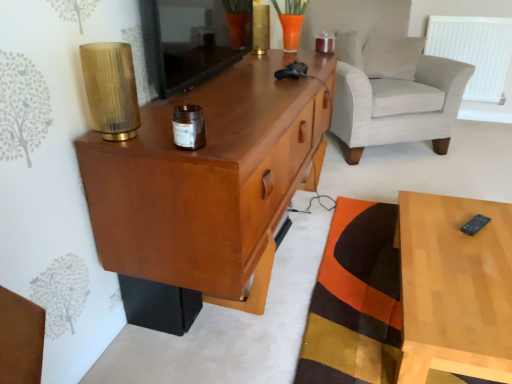
Where is `free space in front of white striped fabric armchair at upper right`? The image size is (512, 384). free space in front of white striped fabric armchair at upper right is located at coordinates (409, 179).